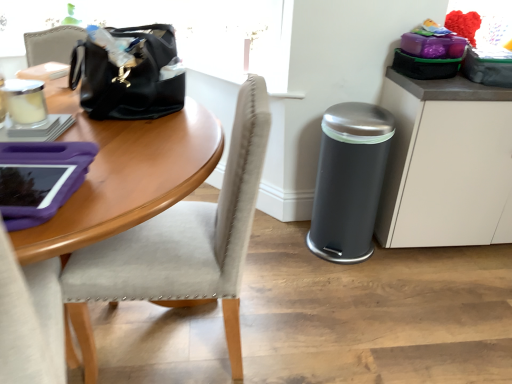
The image size is (512, 384). I want to click on free space to the right of light gray fabric chair at left, so click(x=310, y=320).